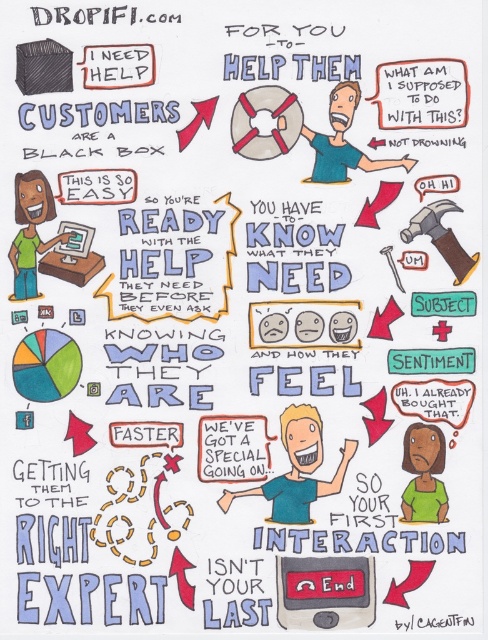
Question: Which point appears farthest from the camera in this image?

Choices:
 (A) (379, 161)
 (B) (240, 134)
 (C) (430, 436)

Answer: (A)

Question: Which object is positioned closest to the matte green shirt at left?

Choices:
 (A) matte gray life preserver at center
 (B) light blue shirt at center

Answer: (A)

Question: Is light blue shirt at center above blue shirt at center?

Choices:
 (A) no
 (B) yes

Answer: (A)

Question: Which object is positioned closest to the light blue shirt at center?

Choices:
 (A) matte green shirt at left
 (B) matte gray life preserver at center
 (C) matte green shirt at lower right

Answer: (C)

Question: Is light blue shirt at center closer to the viewer compared to matte green shirt at left?

Choices:
 (A) yes
 (B) no

Answer: (A)

Question: Is matte gray life preserver at center positioned before blue shirt at center?

Choices:
 (A) no
 (B) yes

Answer: (A)